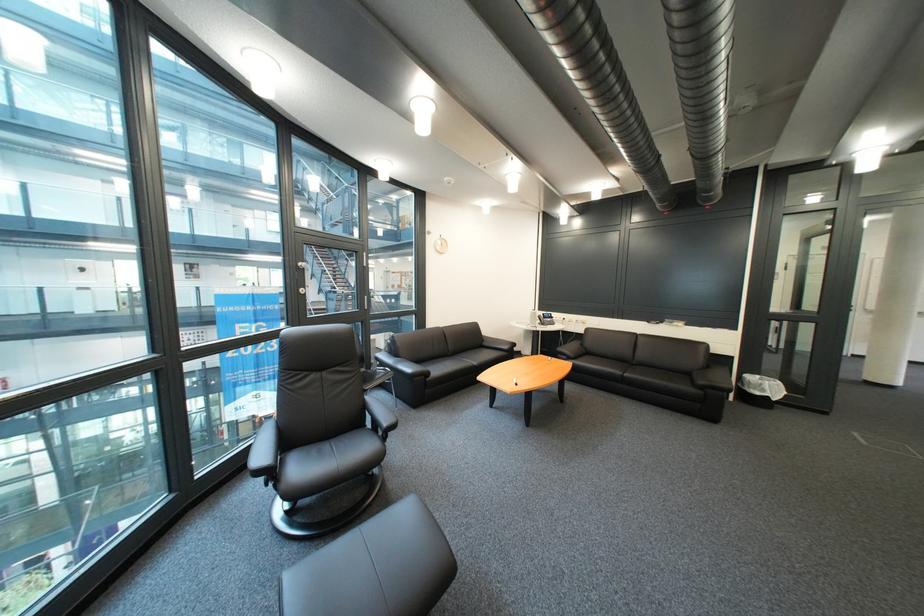
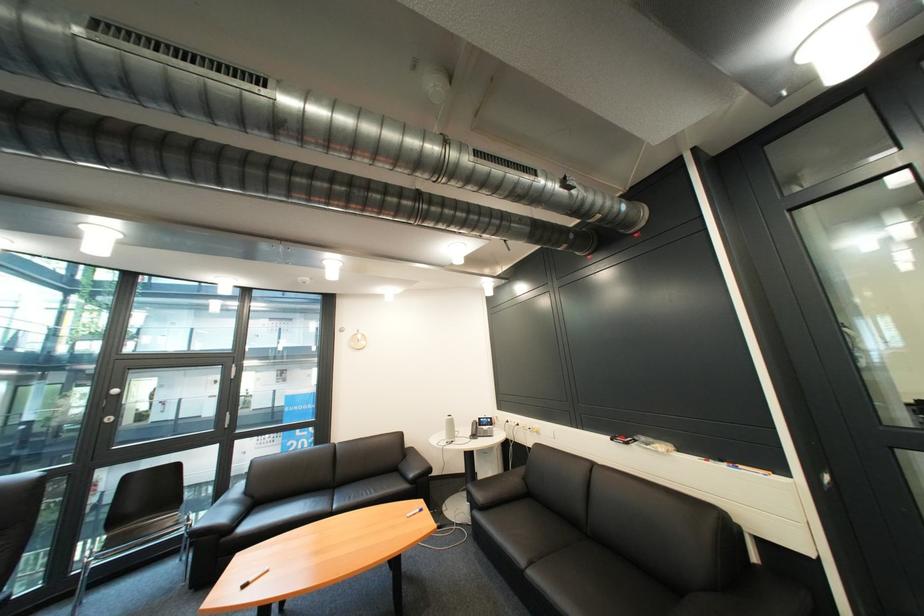
The point at (723, 331) is marked in the first image. Where is the corresponding point in the second image?

(736, 468)